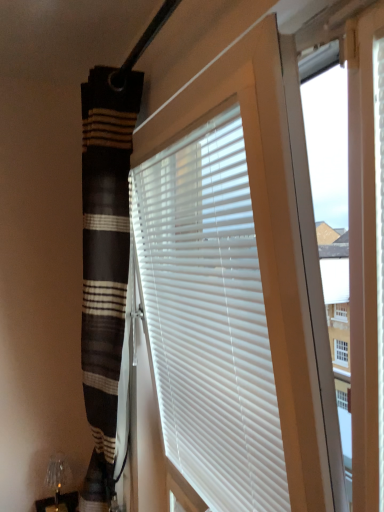
Question: In terms of width, does metallic silver table lamp at lower left look wider or thinner when compared to white matte blinds at center?

Choices:
 (A) wide
 (B) thin

Answer: (A)

Question: From their relative heights in the image, would you say metallic silver table lamp at lower left is taller or shorter than white matte blinds at center?

Choices:
 (A) tall
 (B) short

Answer: (B)

Question: Is point (56, 465) positioned closer to the camera than point (150, 206)?

Choices:
 (A) closer
 (B) farther

Answer: (B)

Question: In terms of height, does white matte blinds at center look taller or shorter compared to metallic silver table lamp at lower left?

Choices:
 (A) tall
 (B) short

Answer: (A)

Question: Is point (248, 501) closer or farther from the camera than point (59, 492)?

Choices:
 (A) closer
 (B) farther

Answer: (A)

Question: Is white matte blinds at center wider or thinner than metallic silver table lamp at lower left?

Choices:
 (A) thin
 (B) wide

Answer: (A)

Question: From a real-world perspective, is white matte blinds at center positioned above or below metallic silver table lamp at lower left?

Choices:
 (A) below
 (B) above

Answer: (B)